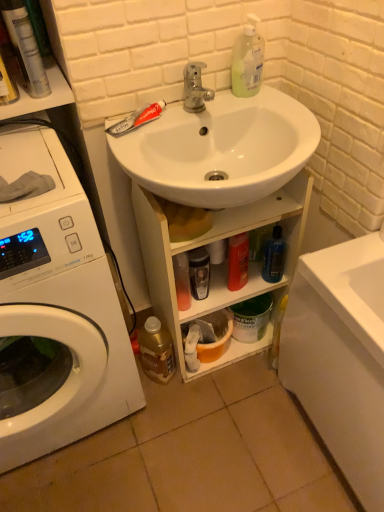
Question: From a real-world perspective, is gold metallic bottle at lower left, which appears as the second bottle when viewed from the right, positioned above or below white glossy washing machine at left?

Choices:
 (A) above
 (B) below

Answer: (B)

Question: Considering the positions of gold metallic bottle at lower left, which ranks as the first bottle in left-to-right order, and white glossy washing machine at left in the image, is gold metallic bottle at lower left, which ranks as the first bottle in left-to-right order, taller or shorter than white glossy washing machine at left?

Choices:
 (A) short
 (B) tall

Answer: (A)

Question: Based on their relative distances, which object is farther from the shiny black bottle at center, the 2th toiletry when ordered from front to back?

Choices:
 (A) white glossy cabinet at center
 (B) blue translucent bottle at lower center, marked as the 2th bottle in a bottom-to-top arrangement
 (C) translucent plastic bottle at upper right
 (D) red matte toothpaste at upper left
 (E) metallic silver spray can at upper left, the first toiletry positioned from the front

Answer: (E)

Question: Estimate the real-world distances between objects in this image. Which object is closer to the metallic silver spray can at upper left, which appears as the third toiletry when viewed from the right?

Choices:
 (A) white glossy washing machine at left
 (B) red matte toothpaste at upper left
 (C) blue translucent bottle at lower center, the first bottle positioned from the right
 (D) gold metallic bottle at lower left, positioned as the 2th bottle in top-to-bottom order
 (E) shiny orange bottle at lower center, the 3th toiletry when ordered from left to right

Answer: (B)